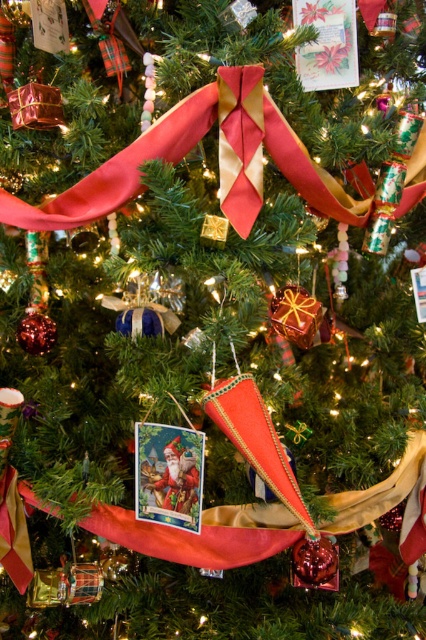
You have a small gift that needs to be placed under the Christmas tree. The gift requires a space that is wider than the silky red ribbon at center. Can you place it next to the matte paper card at center?

The silky red ribbon at center might be wider than the matte paper card at center, so the space next to the matte paper card at center may not be wide enough for the gift if the ribbon is indeed wider. Check the actual width to confirm.

You are organizing the Christmas decorations and need to place both the matte paper card at center and the matte paper card at upper center on the tree. Since you want to ensure visibility, which card should be placed in a position where it can be seen more easily?

The matte paper card at center is larger in size than the matte paper card at upper center, so placing the larger matte paper card at center in a more visible position would ensure it can be easily seen.